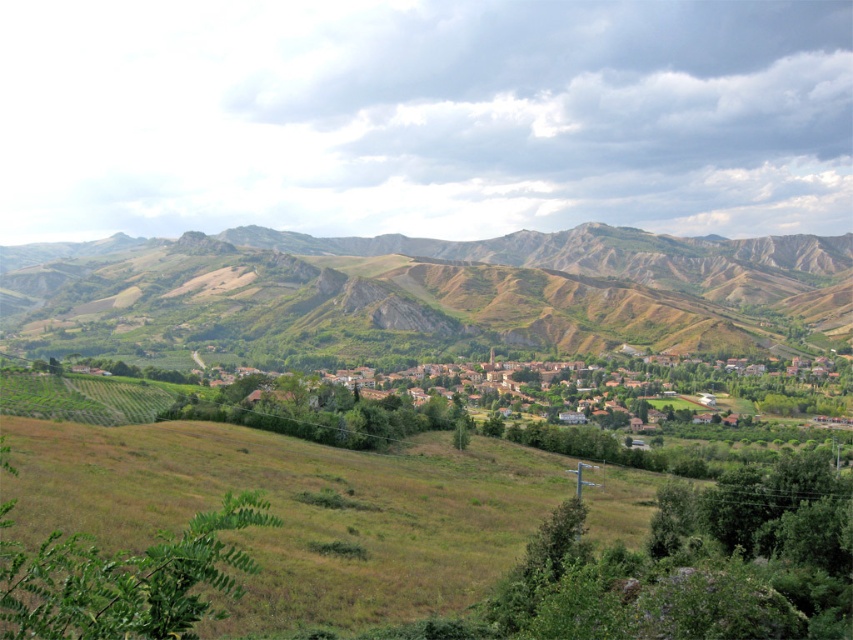
You are standing on a hill overlooking the village. You see the green grassy hillside at center and the brown tiled roofs at center. Which object is closer to you?

The green grassy hillside at center is closer to you because it is in front of the brown tiled roofs at center.

You are standing at the edge of the village and see the green grassy hillside at center and the brown tiled roofs at center. Which one is positioned to the left from your viewpoint?

The green grassy hillside at center is positioned to the left of the brown tiled roofs at center from your viewpoint.